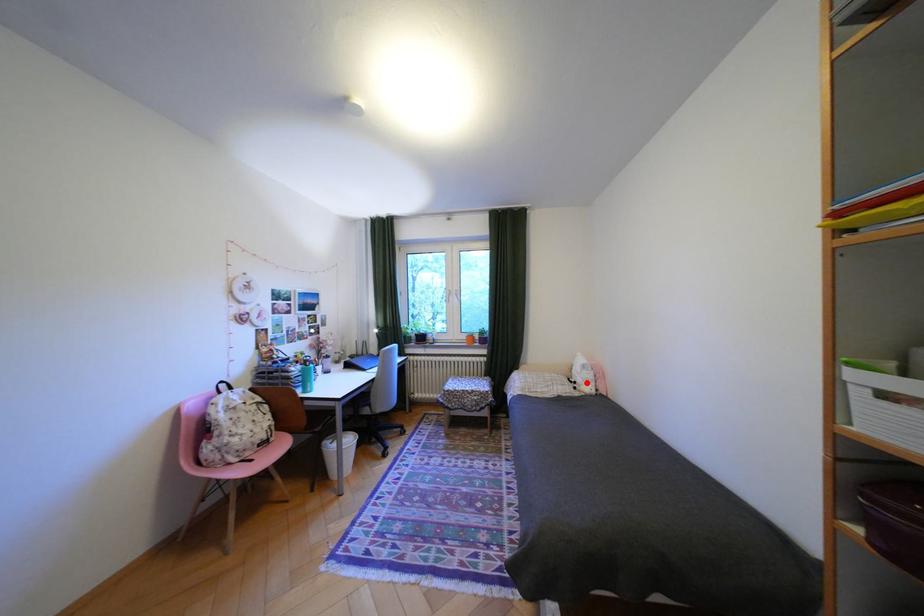
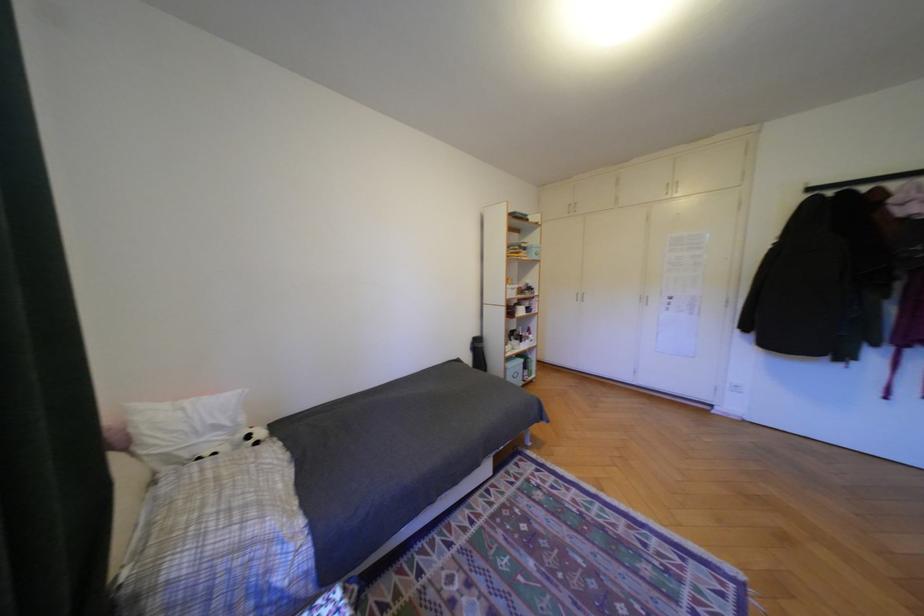
Question: I am providing you with two images of the same scene from different viewpoints. Given a red point in image1, look at the same physical point in image2. Is it:

Choices:
 (A) Closer to the viewpoint
 (B) Farther from the viewpoint

Answer: (A)